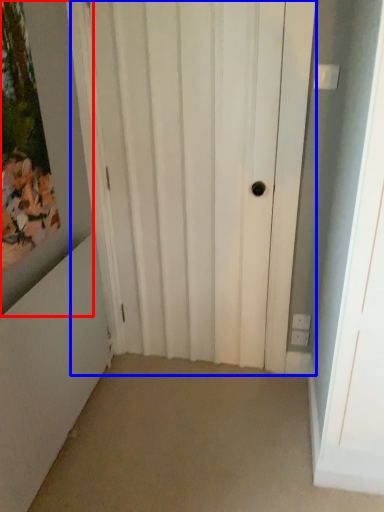
Question: Which object is closer to the camera taking this photo, picture frame (highlighted by a red box) or door (highlighted by a blue box)?

Choices:
 (A) picture frame
 (B) door

Answer: (A)